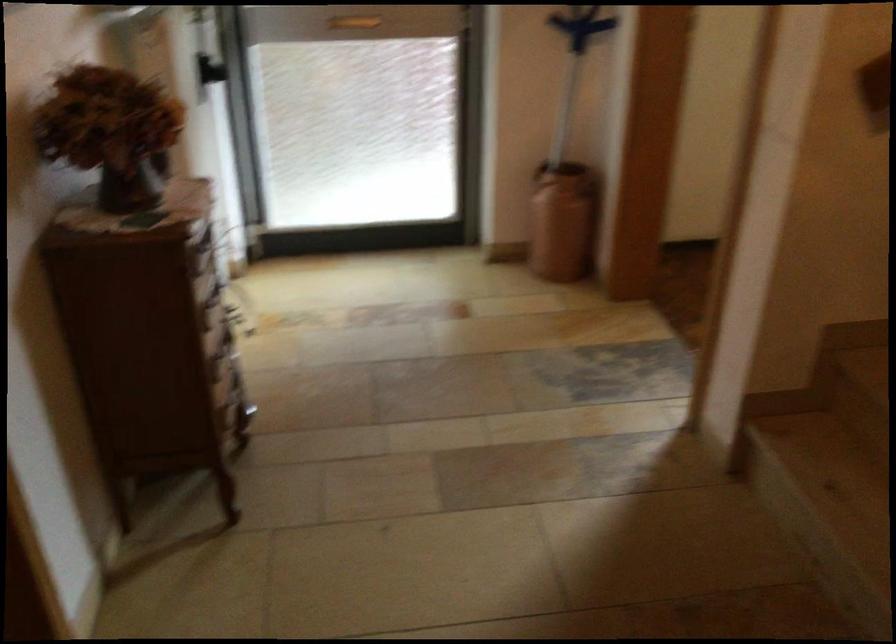
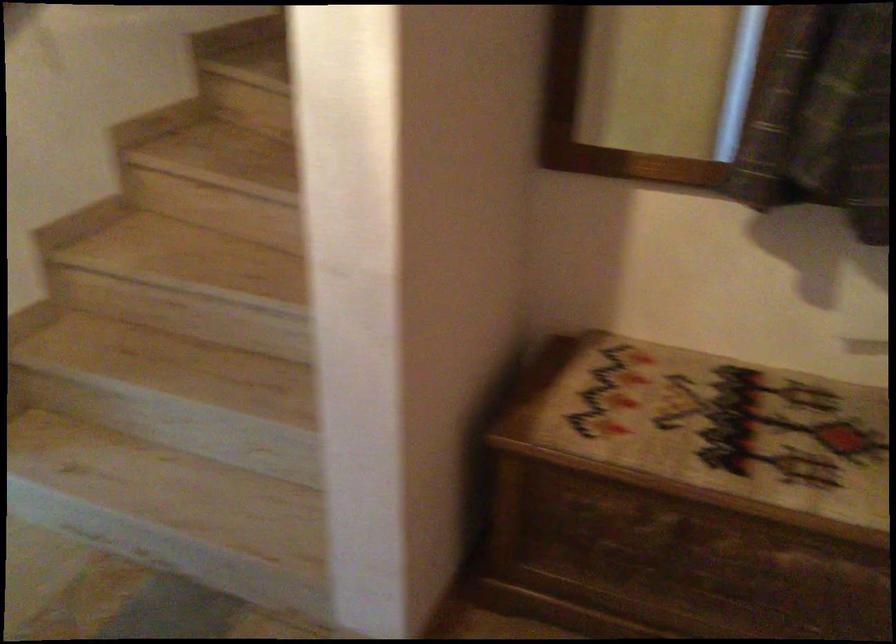
Question: The camera is either moving clockwise (left) or counter-clockwise (right) around the object. The first image is from the beginning of the video and the second image is from the end. Is the camera moving left or right when shooting the video?

Choices:
 (A) Left
 (B) Right

Answer: (A)